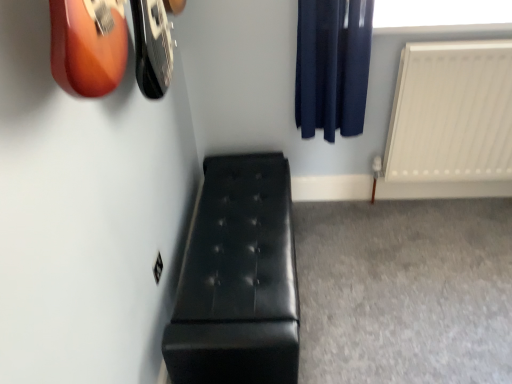
Locate an element on the screen. blank area beneath white matte radiator at right (from a real-world perspective) is located at coordinates [445, 205].